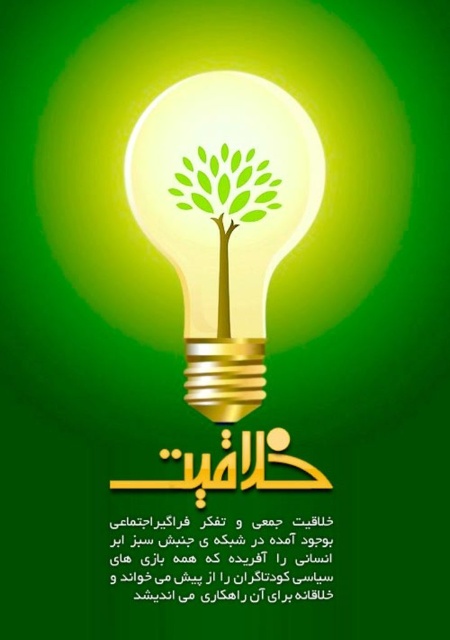
Does gold metallic bulb at center have a smaller size compared to green matte tree at center?

No, gold metallic bulb at center is not smaller than green matte tree at center.

From the picture: Does gold metallic bulb at center appear over green matte tree at center?

No.

Locate an element on the screen. This screenshot has width=450, height=640. gold metallic bulb at center is located at coordinates (225, 218).